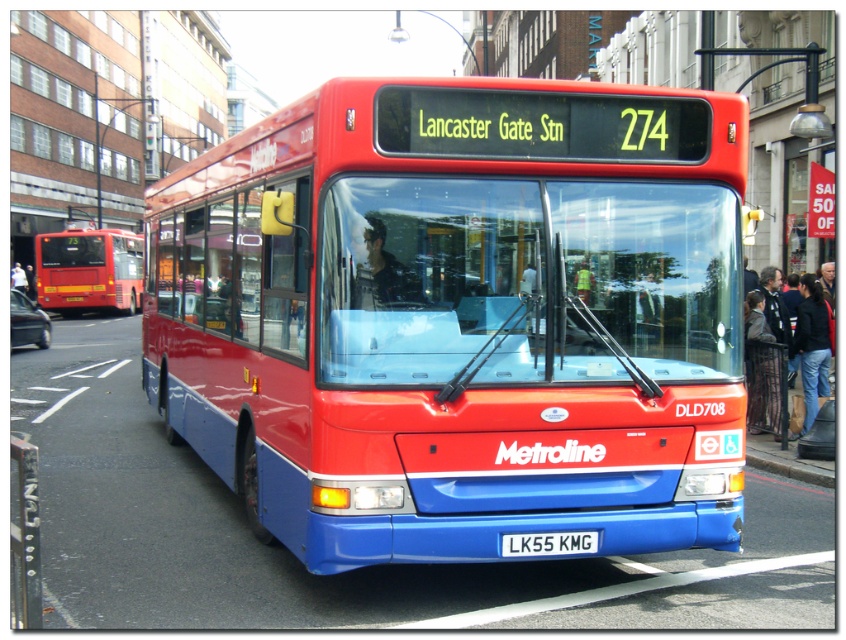
Question: Which object is the closest to the matte red bus at left?

Choices:
 (A) metallic red bus at center
 (B) blue metallic license plate at center

Answer: (A)

Question: Is blue metallic license plate at center to the right of concrete curb at lower right from the viewer's perspective?

Choices:
 (A) yes
 (B) no

Answer: (B)

Question: Which of the following is the farthest from the observer?

Choices:
 (A) metallic red bus at center
 (B) concrete curb at lower right

Answer: (B)

Question: Can you confirm if metallic red bus at center is positioned below blue metallic license plate at center?

Choices:
 (A) yes
 (B) no

Answer: (B)

Question: Among these points, which one is farthest from the camera?

Choices:
 (A) (702, 115)
 (B) (547, 538)

Answer: (A)

Question: Can you confirm if metallic red bus at center is smaller than concrete curb at lower right?

Choices:
 (A) no
 (B) yes

Answer: (A)